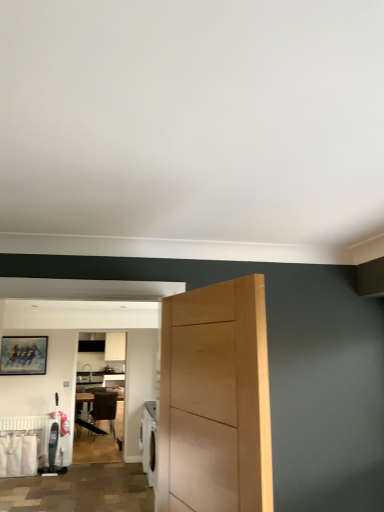
Question: Is wooden table at center to the left of wooden chair at center from the viewer's perspective?

Choices:
 (A) yes
 (B) no

Answer: (A)

Question: Considering the relative sizes of wooden table at center and wooden chair at center in the image provided, is wooden table at center wider than wooden chair at center?

Choices:
 (A) yes
 (B) no

Answer: (A)

Question: Considering the relative sizes of wooden table at center and wooden chair at center in the image provided, is wooden table at center smaller than wooden chair at center?

Choices:
 (A) yes
 (B) no

Answer: (B)

Question: From the image's perspective, is wooden table at center located above wooden chair at center?

Choices:
 (A) no
 (B) yes

Answer: (A)

Question: Considering the relative sizes of wooden table at center and wooden chair at center in the image provided, is wooden table at center thinner than wooden chair at center?

Choices:
 (A) no
 (B) yes

Answer: (A)

Question: In terms of height, does wooden table at center look taller or shorter compared to white matte radiator at lower left?

Choices:
 (A) short
 (B) tall

Answer: (B)

Question: From the image's perspective, is wooden table at center above or below white matte radiator at lower left?

Choices:
 (A) above
 (B) below

Answer: (B)

Question: Is point (112, 426) closer or farther from the camera than point (44, 424)?

Choices:
 (A) closer
 (B) farther

Answer: (B)

Question: Looking at their shapes, would you say wooden table at center is wider or thinner than white matte radiator at lower left?

Choices:
 (A) thin
 (B) wide

Answer: (B)

Question: Do you think white matte radiator at lower left is within wooden chair at center, or outside of it?

Choices:
 (A) outside
 (B) inside

Answer: (A)

Question: From a real-world perspective, is white matte radiator at lower left positioned above or below wooden chair at center?

Choices:
 (A) above
 (B) below

Answer: (B)

Question: Considering the relative positions of white matte radiator at lower left and wooden chair at center in the image provided, is white matte radiator at lower left to the left or to the right of wooden chair at center?

Choices:
 (A) left
 (B) right

Answer: (A)

Question: From the image's perspective, is white matte radiator at lower left located above or below wooden chair at center?

Choices:
 (A) above
 (B) below

Answer: (A)

Question: Considering the positions of light wood door at center and white matte radiator at lower left in the image, is light wood door at center bigger or smaller than white matte radiator at lower left?

Choices:
 (A) big
 (B) small

Answer: (A)

Question: From the image's perspective, relative to white matte radiator at lower left, is light wood door at center above or below?

Choices:
 (A) below
 (B) above

Answer: (B)